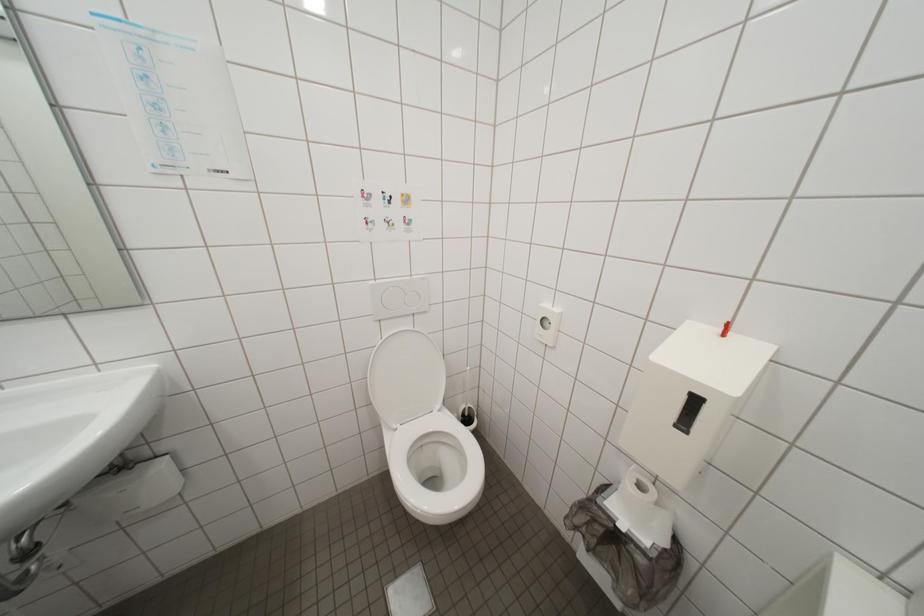
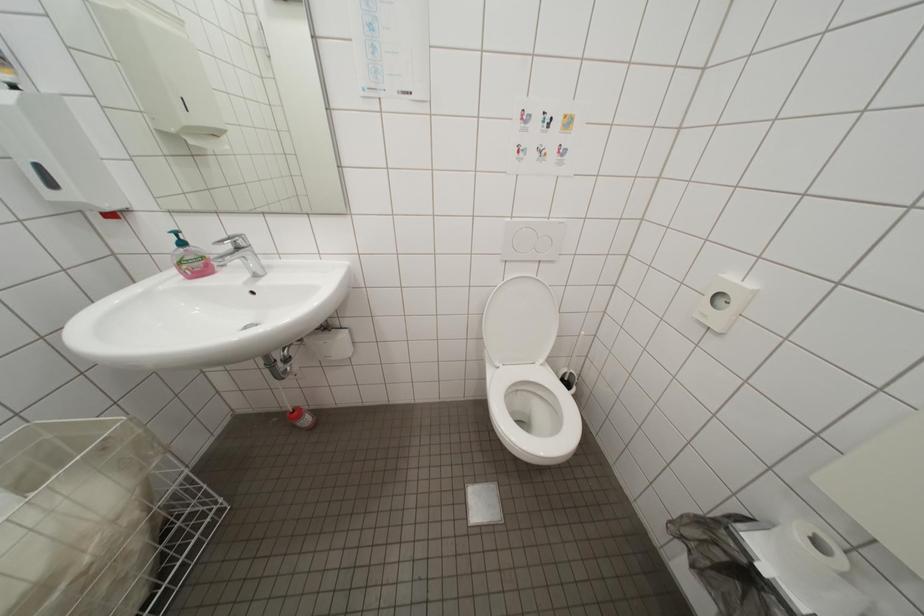
Question: The camera is either moving clockwise (left) or counter-clockwise (right) around the object. The first image is from the beginning of the video and the second image is from the end. Is the camera moving left or right when shooting the video?

Choices:
 (A) Left
 (B) Right

Answer: (B)